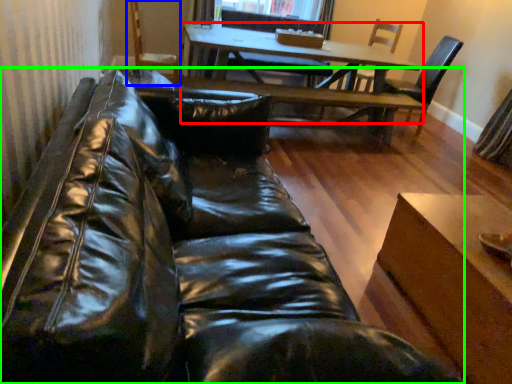
Question: Which is farther away from table (highlighted by a red box)? armchair (highlighted by a blue box) or studio couch (highlighted by a green box)?

Choices:
 (A) armchair
 (B) studio couch

Answer: (B)